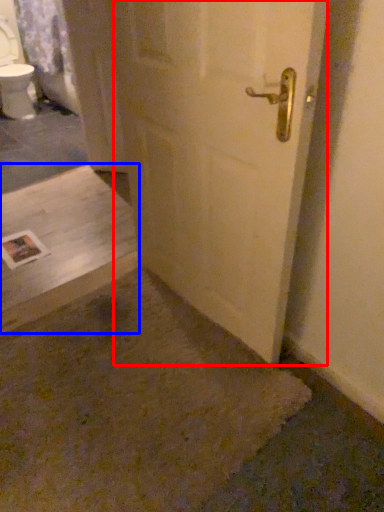
Question: Which point is further to the camera, door (highlighted by a red box) or concrete (highlighted by a blue box)?

Choices:
 (A) door
 (B) concrete

Answer: (B)